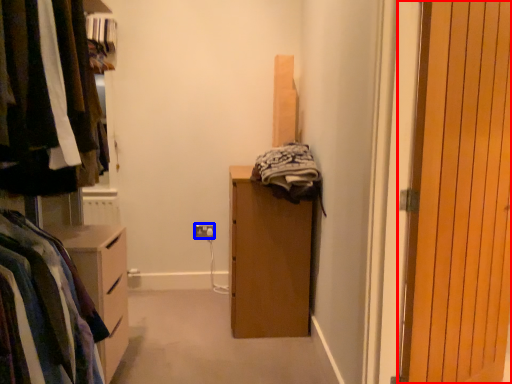
Question: Which of the following is the closest to the observer, door (highlighted by a red box) or electric outlet (highlighted by a blue box)?

Choices:
 (A) door
 (B) electric outlet

Answer: (A)